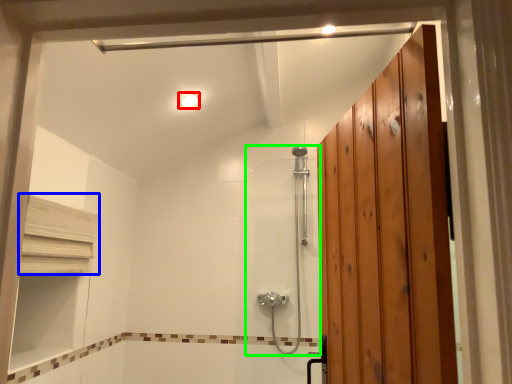
Question: Estimate the real-world distances between objects in this image. Which object is farther from light fixture (highlighted by a red box), shelf (highlighted by a blue box) or shower door (highlighted by a green box)?

Choices:
 (A) shelf
 (B) shower door

Answer: (B)